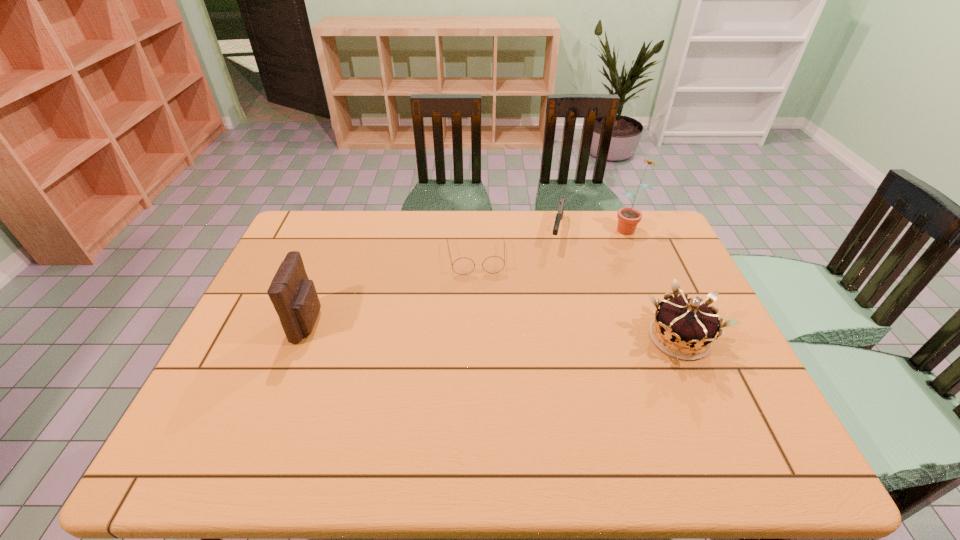
You are a GUI agent. You are given a task and a screenshot of the screen. Output one action in this format:
    pyautogui.click(x=<x>, y=<y>)
    Task: Click on the free space on the desktop that is between the pouch and the third tallest object and is positioned on the temples of the shortest object
    This screenshot has width=960, height=540.
    Given the screenshot: What is the action you would take?
    pyautogui.click(x=483, y=330)

This screenshot has height=540, width=960. I want to click on free space on the desktop that is between the fourth shortest object and the crown and is positioned at the muzzle end of the second shortest object, so click(535, 332).

Identify the location of vacant space on the desktop that is between the pouch and the third shortest object and is positioned on the flower of the sunflower. (537, 332).